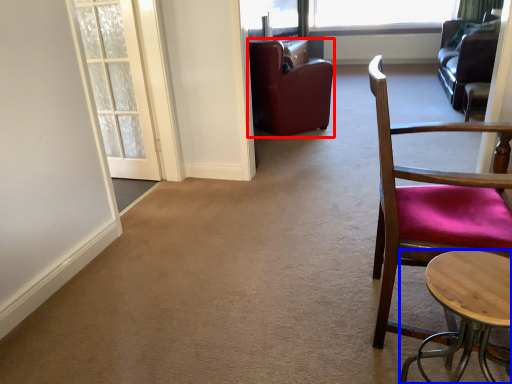
Question: Which of the following is the farthest to the observer, chair (highlighted by a red box) or table (highlighted by a blue box)?

Choices:
 (A) chair
 (B) table

Answer: (A)